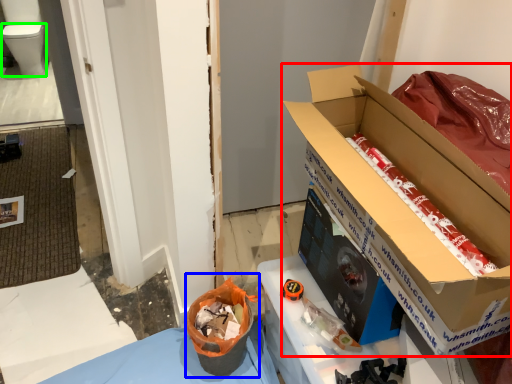
Question: Which is farther away from box (highlighted by a red box)? recycling bin (highlighted by a blue box) or toilet bowl (highlighted by a green box)?

Choices:
 (A) recycling bin
 (B) toilet bowl

Answer: (B)